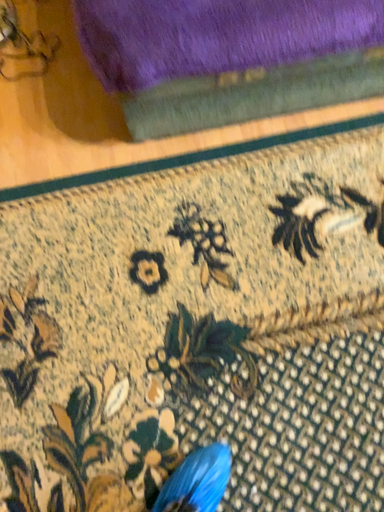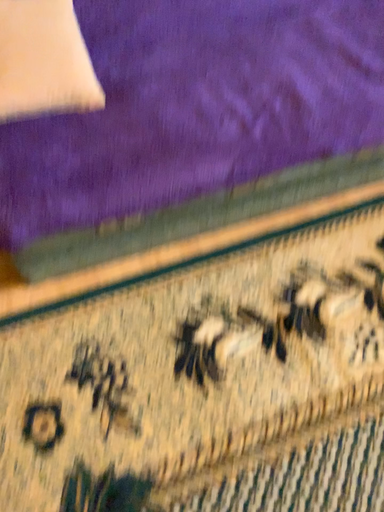
Question: Which way did the camera rotate in the video?

Choices:
 (A) rotated upward
 (B) rotated downward

Answer: (A)